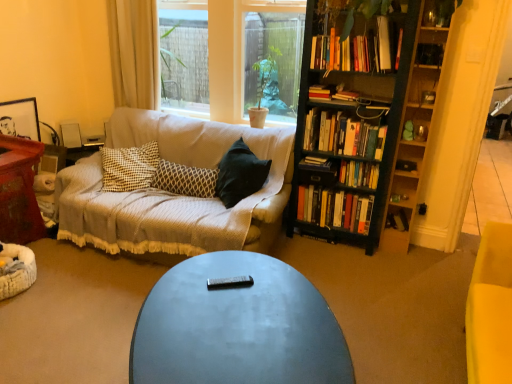
Identify the location of free space in front of black wood bookcase at right. (354, 268).